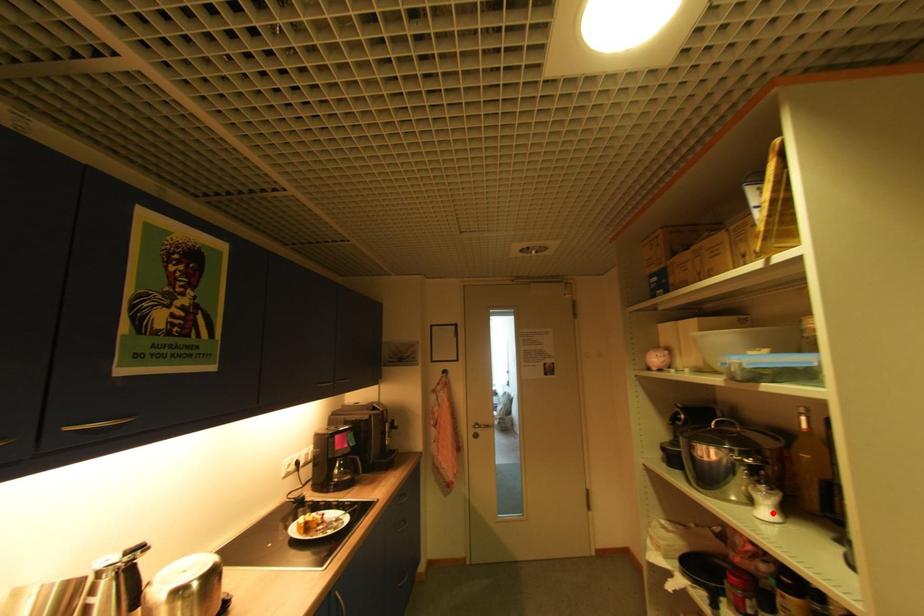
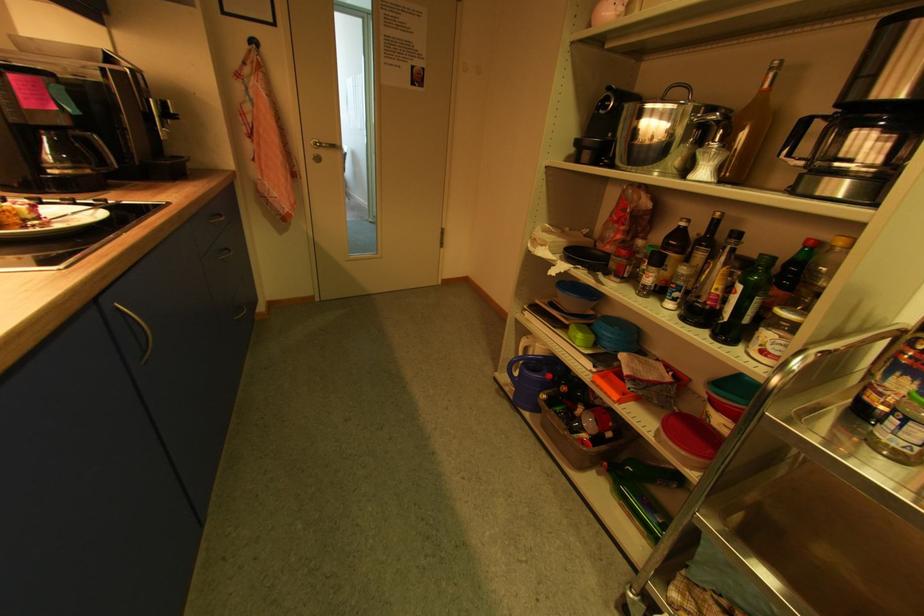
Question: I am providing you with two images of the same scene from different viewpoints. A red point is marked on the first image. At the location where the point appears in image 1, is it still visible in image 2?

Choices:
 (A) Yes
 (B) No

Answer: (A)